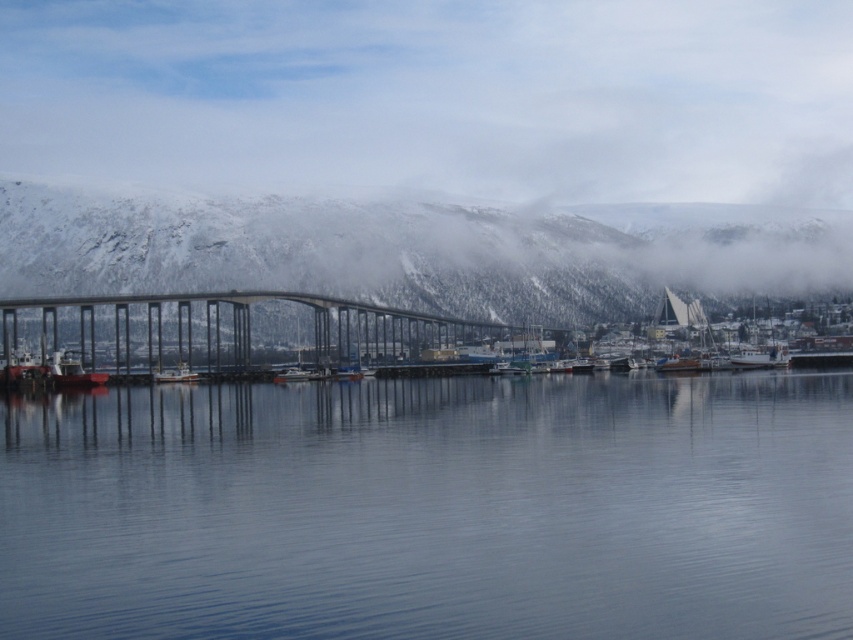
Who is positioned more to the left, smooth blue water at center or concrete bridge at center?

From the viewer's perspective, concrete bridge at center appears more on the left side.

Is point (3, 636) farther from camera compared to point (3, 301)?

No, (3, 636) is closer to viewer.

I want to click on smooth blue water at center, so click(x=432, y=508).

Which is behind, point (604, 440) or point (579, 209)?

Positioned behind is point (579, 209).

Between point (556, 577) and point (663, 280), which one is positioned in front?

Point (556, 577) is in front.

Identify the location of smooth blue water at center. (432, 508).

I want to click on snowy rock mountain at upper center, so click(x=415, y=250).

Which is behind, point (550, 317) or point (223, 333)?

The point (550, 317) is behind.

Is point (706, 244) positioned before point (64, 317)?

No, it is behind (64, 317).

In order to click on snowy rock mountain at upper center in this screenshot , I will do `click(415, 250)`.